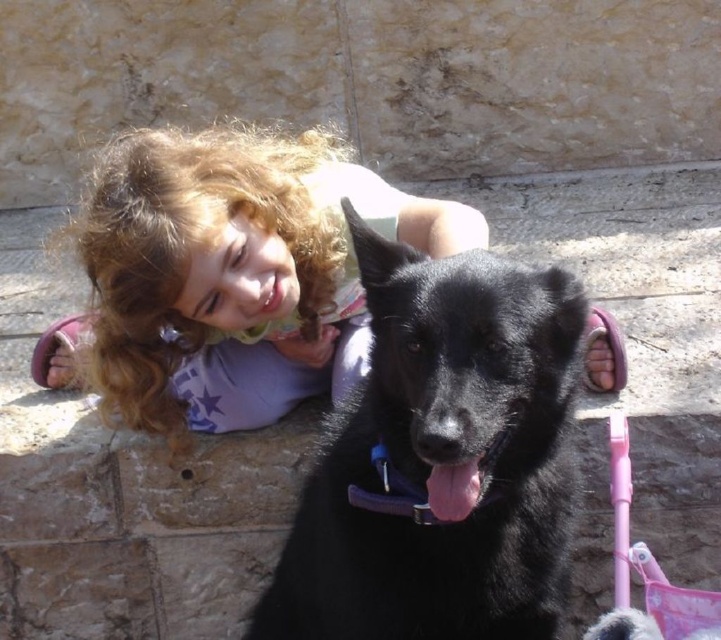
Question: Is black smooth dog at center above curly hair at center?

Choices:
 (A) yes
 (B) no

Answer: (B)

Question: Which point is closer to the camera?

Choices:
 (A) pink plastic baby carriage at lower right
 (B) curly hair at center
 (C) black smooth dog at center

Answer: (C)

Question: Is curly hair at center positioned before pink plastic baby carriage at lower right?

Choices:
 (A) yes
 (B) no

Answer: (B)

Question: Which point is farther to the camera?

Choices:
 (A) black smooth dog at center
 (B) curly hair at center
 (C) pink plastic baby carriage at lower right

Answer: (B)

Question: Is curly hair at center to the left of pink plastic baby carriage at lower right from the viewer's perspective?

Choices:
 (A) no
 (B) yes

Answer: (B)

Question: Among these objects, which one is nearest to the camera?

Choices:
 (A) pink plastic baby carriage at lower right
 (B) curly hair at center

Answer: (A)